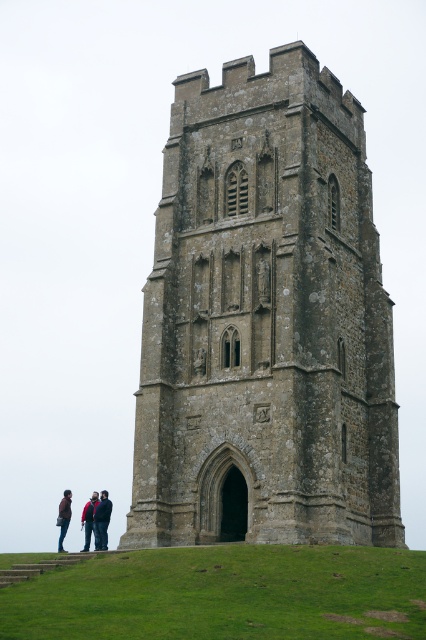
Where is `green grass at lower center`? This screenshot has height=640, width=426. green grass at lower center is located at coordinates (221, 595).

Does green grass at lower center have a greater height compared to dark red jacket at lower left?

No, green grass at lower center is not taller than dark red jacket at lower left.

Which is in front, point (37, 627) or point (83, 513)?

Point (37, 627) is in front.

I want to click on green grass at lower center, so click(221, 595).

Can you confirm if green grass at lower center is positioned above dark blue jacket at lower left?

Yes.

Who is positioned more to the right, green grass at lower center or dark blue jacket at lower left?

From the viewer's perspective, green grass at lower center appears more on the right side.

At what (x,y) coordinates should I click in order to perform the action: click on green grass at lower center. Please return your answer as a coordinate pair (x, y). Looking at the image, I should click on (221, 595).

This screenshot has height=640, width=426. Identify the location of green grass at lower center. (221, 595).

Is stone tower at center smaller than dark blue jacket at lower left?

Incorrect, stone tower at center is not smaller in size than dark blue jacket at lower left.

Who is more distant from viewer, (120, 544) or (104, 531)?

Positioned behind is point (104, 531).

Locate an element on the screen. This screenshot has height=640, width=426. stone tower at center is located at coordinates (265, 321).